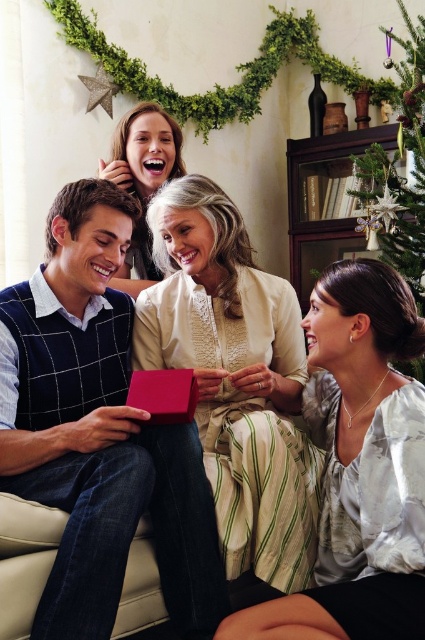
Question: Is green textured christmas tree at upper right below smooth beige blouse at upper center?

Choices:
 (A) no
 (B) yes

Answer: (A)

Question: Which object appears closest to the camera in this image?

Choices:
 (A) smooth beige blouse at upper center
 (B) matte cream blouse at center

Answer: (B)

Question: Which point appears farthest from the camera in this image?

Choices:
 (A) (127, 404)
 (B) (376, 477)
 (C) (302, 499)
 (D) (172, 152)

Answer: (D)

Question: Which object is closer to the camera taking this photo?

Choices:
 (A) green textured christmas tree at upper right
 (B) smooth beige blouse at upper center
 (C) silky white blouse at lower right

Answer: (C)

Question: Does green textured christmas tree at upper right appear under smooth beige blouse at upper center?

Choices:
 (A) no
 (B) yes

Answer: (A)

Question: Is green textured christmas tree at upper right positioned in front of shiny red box at center?

Choices:
 (A) yes
 (B) no

Answer: (B)